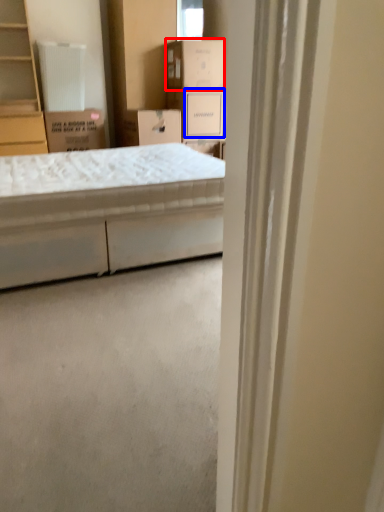
Question: Among these objects, which one is farthest to the camera, cardboard box (highlighted by a red box) or storage box (highlighted by a blue box)?

Choices:
 (A) cardboard box
 (B) storage box

Answer: (B)